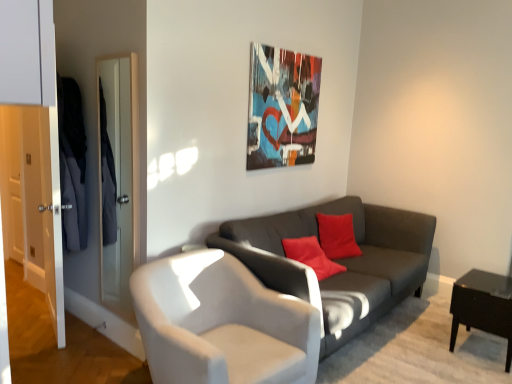
Question: Is metallic abstract art at upper center taller or shorter than white leather chair at center?

Choices:
 (A) tall
 (B) short

Answer: (A)

Question: In terms of width, does metallic abstract art at upper center look wider or thinner when compared to white leather chair at center?

Choices:
 (A) wide
 (B) thin

Answer: (B)

Question: Which object is the farthest from the metallic abstract art at upper center?

Choices:
 (A) white leather chair at center
 (B) black glossy side table at lower right
 (C) dark gray fabric couch at center

Answer: (B)

Question: Which object is positioned farthest from the metallic abstract art at upper center?

Choices:
 (A) white leather chair at center
 (B) dark gray fabric couch at center
 (C) black glossy side table at lower right

Answer: (C)